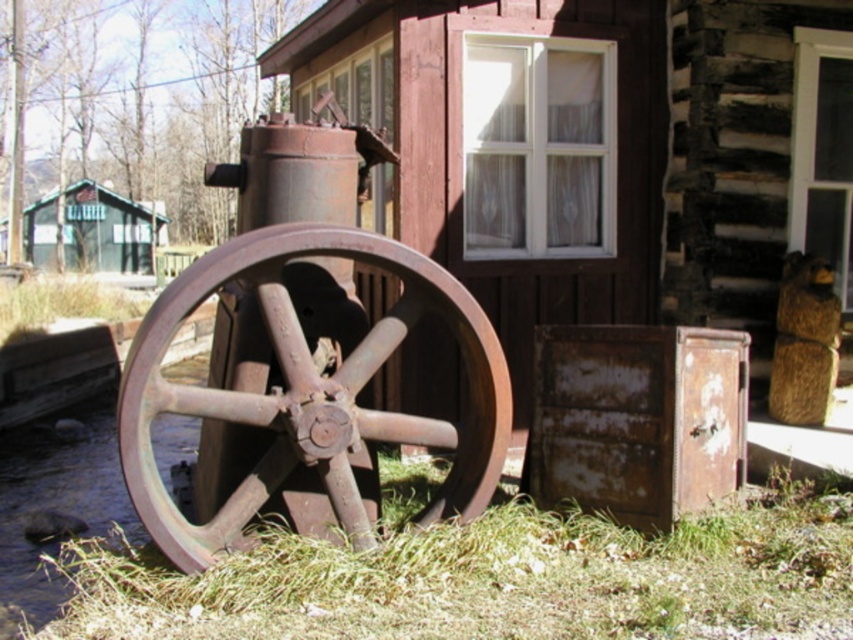
Question: Can you confirm if rusty wood cabin at center is positioned to the left of green grass at lower center?

Choices:
 (A) no
 (B) yes

Answer: (B)

Question: Which object is the closest to the green grass at lower center?

Choices:
 (A) rusty metal wagon wheel at left
 (B) rusty wood cabin at center
 (C) green wood cabin at left

Answer: (A)

Question: Can you confirm if rusty wood cabin at center is wider than green grass at lower center?

Choices:
 (A) no
 (B) yes

Answer: (B)

Question: Which of these objects is positioned closest to the rusty wood cabin at center?

Choices:
 (A) rusty metal wagon wheel at left
 (B) green grass at lower center

Answer: (A)

Question: Which point appears closest to the camera in this image?

Choices:
 (A) (206, 566)
 (B) (65, 244)
 (C) (549, 108)
 (D) (218, 636)

Answer: (D)

Question: Is green grass at lower center smaller than rusty metal wagon wheel at left?

Choices:
 (A) no
 (B) yes

Answer: (B)